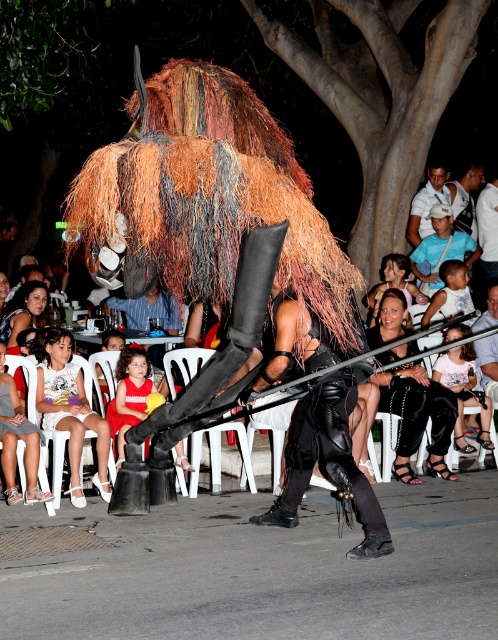
Question: Is white cotton dress at lower left closer to the viewer compared to shiny gold armor at center?

Choices:
 (A) no
 (B) yes

Answer: (B)

Question: Which object is closer to the camera taking this photo?

Choices:
 (A) matte black dress at lower center
 (B) black leather pants at center
 (C) dark blue shirt at center

Answer: (B)

Question: Based on their relative distances, which object is nearer to the dark blue shirt at center?

Choices:
 (A) smooth black dress at center
 (B) matte black dress at lower center
 (C) matte gray dress at lower left
 (D) light gray fabric dress at lower left

Answer: (A)

Question: Based on their relative distances, which object is farther from the matte black dress at lower center?

Choices:
 (A) red satin dress at center
 (B) light blue cotton shirt at upper right
 (C) dark blue shirt at center

Answer: (C)

Question: Observing the image, what is the correct spatial positioning of white cotton dress at lower left in reference to smooth black dress at center?

Choices:
 (A) below
 (B) above

Answer: (A)

Question: Does smooth black dress at center have a greater width compared to shiny gold armor at center?

Choices:
 (A) no
 (B) yes

Answer: (B)